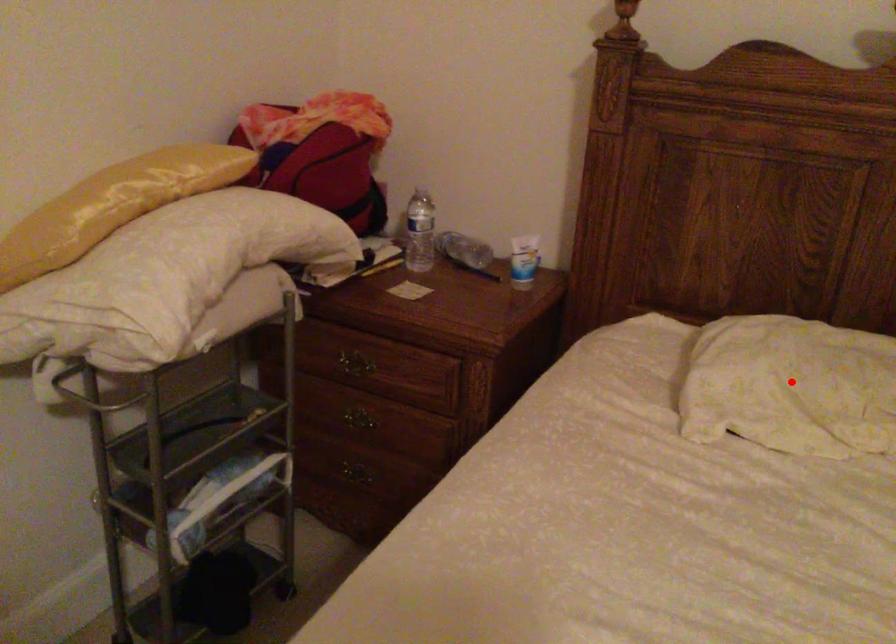
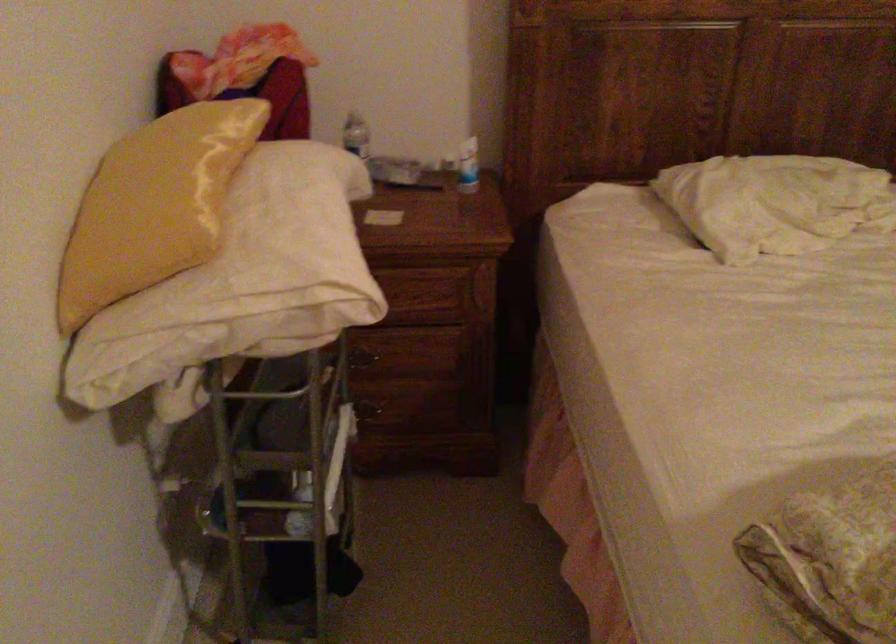
Question: I am providing you with two images of the same scene from different viewpoints. A red point is marked on the first image. Is the red point's position out of view in image 2?

Choices:
 (A) Yes
 (B) No

Answer: (B)